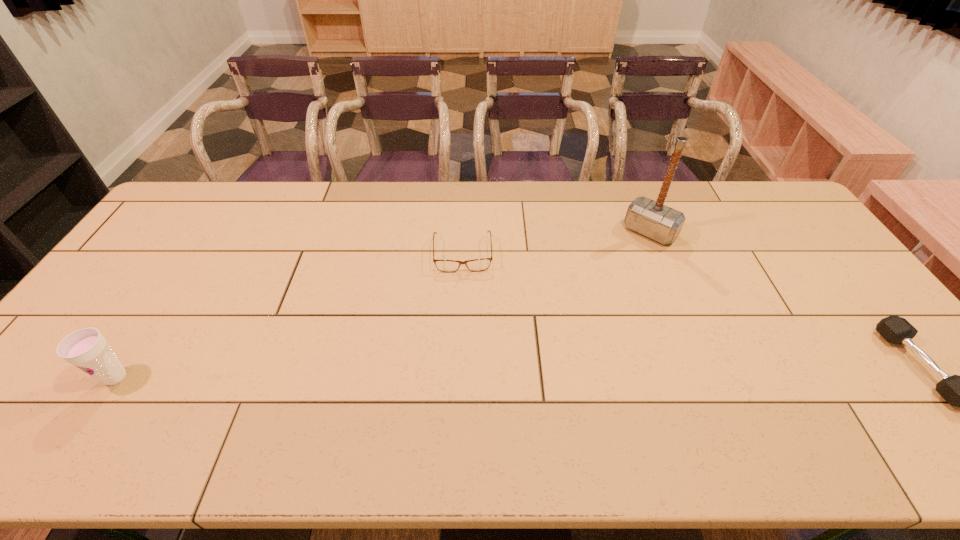
You are a GUI agent. You are given a task and a screenshot of the screen. Output one action in this format:
    pyautogui.click(x=<x>, y=<y>)
    Task: Click on the free spot on the desktop that is between the second tallest object and the dumbbell and is positioned on the striking surface of the second object from right to left
    The height and width of the screenshot is (540, 960).
    Given the screenshot: What is the action you would take?
    pyautogui.click(x=522, y=372)

You are a GUI agent. You are given a task and a screenshot of the screen. Output one action in this format:
    pyautogui.click(x=<x>, y=<y>)
    Task: Click on the free space on the desktop that is between the leftmost object and the dumbbell and is positioned on the lenses of the second object from left to right
    
    Given the screenshot: What is the action you would take?
    pyautogui.click(x=466, y=373)